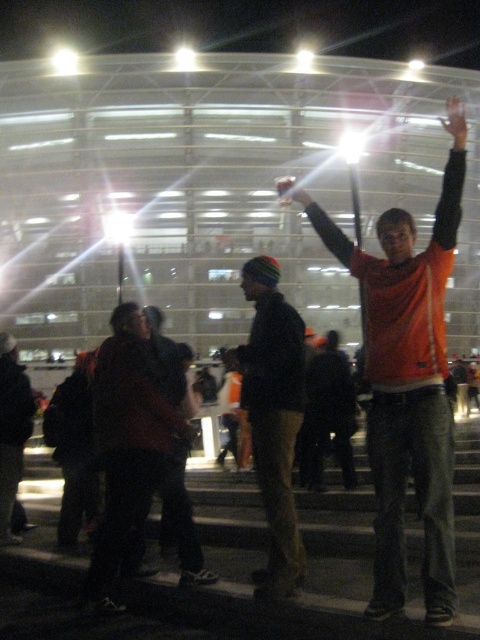
Question: Can you confirm if dark brown leather jacket at lower left is positioned below matte black hand at upper right?

Choices:
 (A) yes
 (B) no

Answer: (A)

Question: Does knit cap at center appear under dark brown leather jacket at lower left?

Choices:
 (A) no
 (B) yes

Answer: (B)

Question: Can you confirm if orange matte shirt at center is positioned above knit cap at center?

Choices:
 (A) yes
 (B) no

Answer: (A)

Question: Which object appears farthest from the camera in this image?

Choices:
 (A) orange matte shirt at center
 (B) knit cap at center

Answer: (B)

Question: Which point is closer to the camera taking this photo?

Choices:
 (A) (450, 124)
 (B) (290, 525)
 (C) (288, 188)

Answer: (A)

Question: Which object is the farthest from the dark brown leather jacket at lower left?

Choices:
 (A) orange matte shirt at center
 (B) matte black hand at upper center
 (C) knit cap at center

Answer: (B)